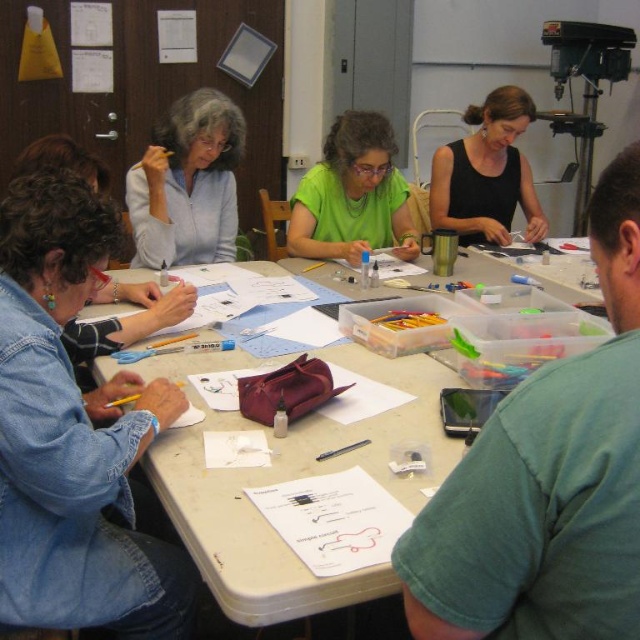
Question: Which point is farther from the camera taking this photo?

Choices:
 (A) (353, 493)
 (B) (188, 196)
 (C) (444, 202)
 (D) (164, 353)

Answer: (C)

Question: Which point appears farthest from the camera in this image?

Choices:
 (A) (314, 538)
 (B) (340, 148)
 (C) (147, 348)

Answer: (B)

Question: Can you confirm if matte gray jacket at upper left is positioned to the right of white paper at center?

Choices:
 (A) no
 (B) yes

Answer: (A)

Question: Does black matte phone at upper center lie behind black matte shirt at upper center?

Choices:
 (A) no
 (B) yes

Answer: (A)

Question: Where is white plastic table at center located in relation to white paper at center in the image?

Choices:
 (A) above
 (B) below

Answer: (A)

Question: Among these objects, which one is nearest to the camera?

Choices:
 (A) matte gray jacket at upper left
 (B) green matte shirt at center
 (C) denim jacket at lower left

Answer: (C)